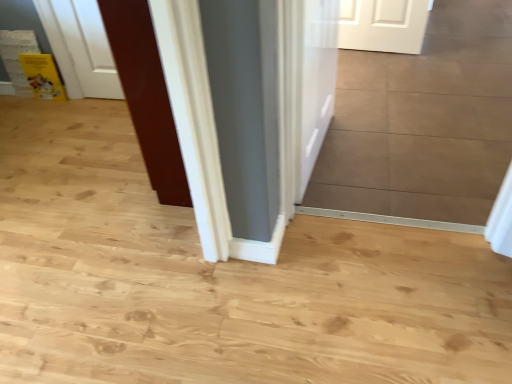
You are a GUI agent. You are given a task and a screenshot of the screen. Output one action in this format:
    pyautogui.click(x=<x>, y=<y>)
    Task: Click on the free spot below white glossy door at center, which is the second door from left to right (from a real-world perspective)
    The height and width of the screenshot is (384, 512).
    Given the screenshot: What is the action you would take?
    pyautogui.click(x=321, y=158)